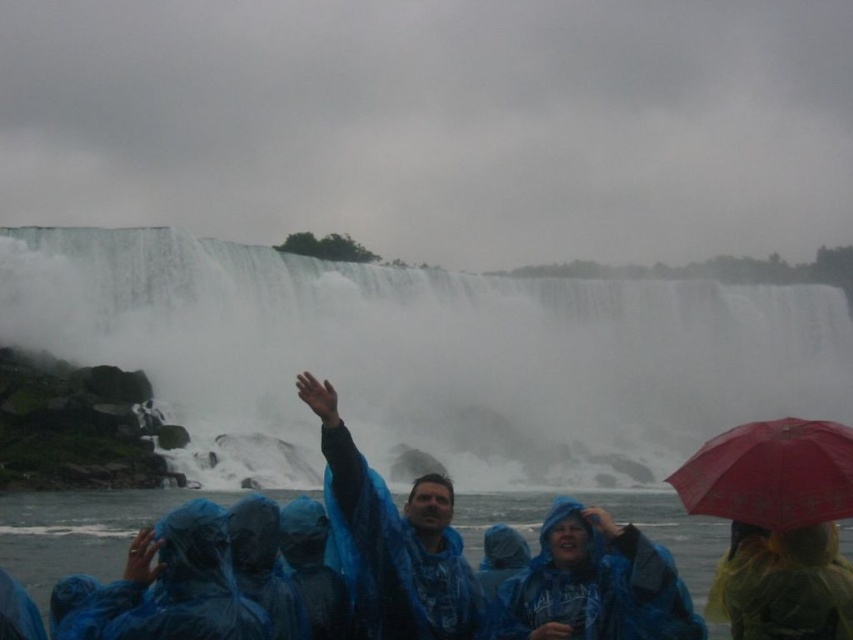
You are a photographer planning to capture the white misty waterfall at upper center and the blue waterproof jacket at lower center in a single frame. Given that the waterfall is taller than the jacket, how should you adjust your camera angle to ensure both are fully visible?

To capture both the white misty waterfall at upper center and the blue waterproof jacket at lower center in a single frame, you should lower your camera angle to include the full height of the waterfall while still framing the jacket at the bottom of the image.

You are standing at point A, which is at coordinates point [236,296], and you want to move to point B at coordinates point [630,582]. However, there is a waterfall between you and point B. Can you see point B from your current position at point A?

Point [236,296] is behind point [630,582], so you cannot see point B from your current position at point A because it is obstructed by the waterfall between them.

You are a photographer standing at the edge of the waterfall and want to take a picture of the blue waterproof jacket at lower center. Where should you point your camera?

You should point your camera at point (595, 584) to capture the blue waterproof jacket at lower center.